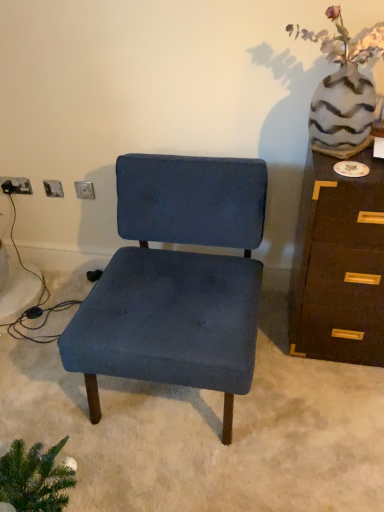
Question: Is brown wood chest of drawers at right oriented towards metallic silver electric outlet at upper left, marked as the 1th electric outlet in a right-to-left arrangement?

Choices:
 (A) yes
 (B) no

Answer: (B)

Question: Is brown wood chest of drawers at right located outside metallic silver electric outlet at upper left, which is counted as the 2th electric outlet, starting from the back?

Choices:
 (A) no
 (B) yes

Answer: (B)

Question: Is brown wood chest of drawers at right positioned with its back to metallic silver electric outlet at upper left, marked as the 1th electric outlet in a right-to-left arrangement?

Choices:
 (A) no
 (B) yes

Answer: (A)

Question: Considering the relative sizes of brown wood chest of drawers at right and metallic silver electric outlet at upper left, marked as the 1th electric outlet in a right-to-left arrangement, in the image provided, is brown wood chest of drawers at right smaller than metallic silver electric outlet at upper left, marked as the 1th electric outlet in a right-to-left arrangement,?

Choices:
 (A) no
 (B) yes

Answer: (A)

Question: Is brown wood chest of drawers at right further to the viewer compared to metallic silver electric outlet at upper left, which is the second electric outlet from left to right?

Choices:
 (A) yes
 (B) no

Answer: (B)

Question: Does brown wood chest of drawers at right appear on the right side of metallic silver electric outlet at upper left, the 1th electric outlet when ordered from front to back?

Choices:
 (A) no
 (B) yes

Answer: (B)

Question: Is brown wood chest of drawers at right positioned beyond the bounds of matte silver outlet at lower left, the second electric outlet viewed from the right?

Choices:
 (A) no
 (B) yes

Answer: (B)

Question: From a real-world perspective, is brown wood chest of drawers at right located higher than matte silver outlet at lower left, acting as the 2th electric outlet starting from the front?

Choices:
 (A) yes
 (B) no

Answer: (B)

Question: Are brown wood chest of drawers at right and matte silver outlet at lower left, arranged as the 1th electric outlet when viewed from the left, making contact?

Choices:
 (A) no
 (B) yes

Answer: (A)

Question: Could you tell me if brown wood chest of drawers at right is facing matte silver outlet at lower left, arranged as the 1th electric outlet when viewed from the left?

Choices:
 (A) yes
 (B) no

Answer: (B)

Question: Can you confirm if brown wood chest of drawers at right is thinner than matte silver outlet at lower left, arranged as the 1th electric outlet when viewed from the left?

Choices:
 (A) yes
 (B) no

Answer: (B)

Question: Is brown wood chest of drawers at right at the left side of matte silver outlet at lower left, the second electric outlet viewed from the right?

Choices:
 (A) yes
 (B) no

Answer: (B)

Question: Can you confirm if matte silver outlet at lower left, arranged as the 1th electric outlet when viewed from the left, is taller than speckled ceramic vase at upper right?

Choices:
 (A) yes
 (B) no

Answer: (B)